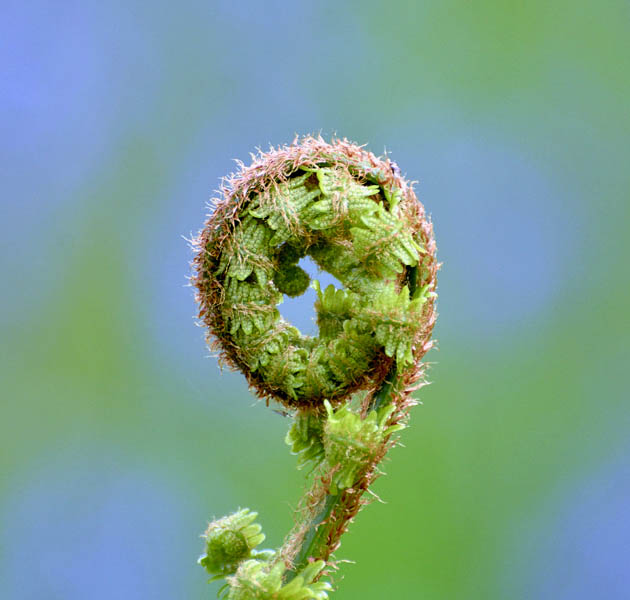
I want to click on plant object, so click(x=378, y=243).